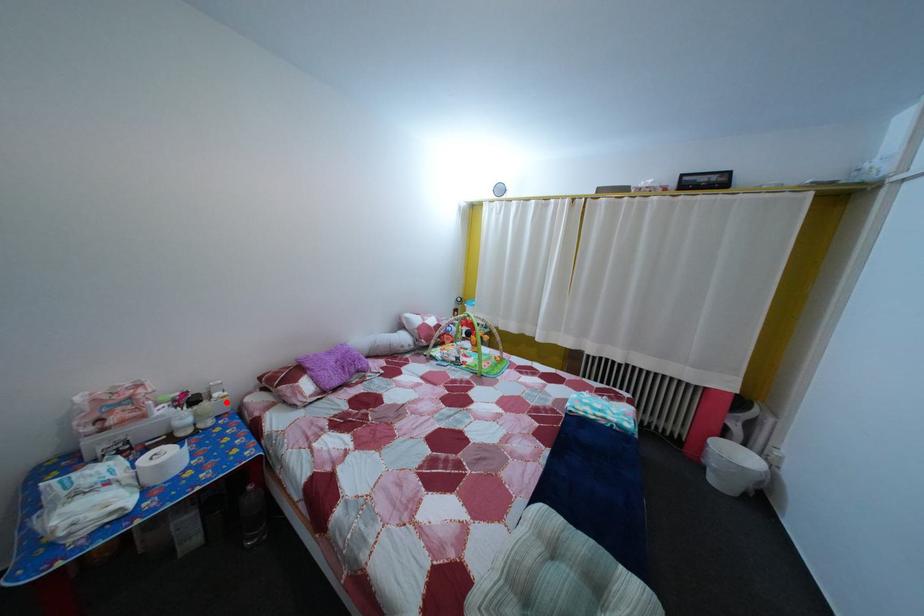
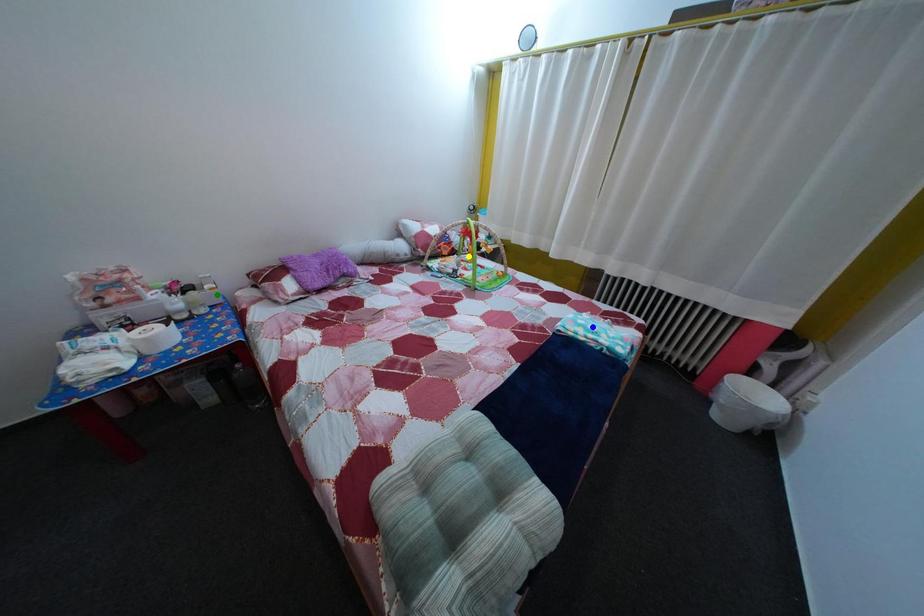
Question: I am providing you with two images of the same scene from different viewpoints. A red point is marked on the first image. You are given multiple points on the second image. In image 2, which mark is for the same physical point as the one in image 1?

Choices:
 (A) green point
 (B) blue point
 (C) yellow point

Answer: (A)